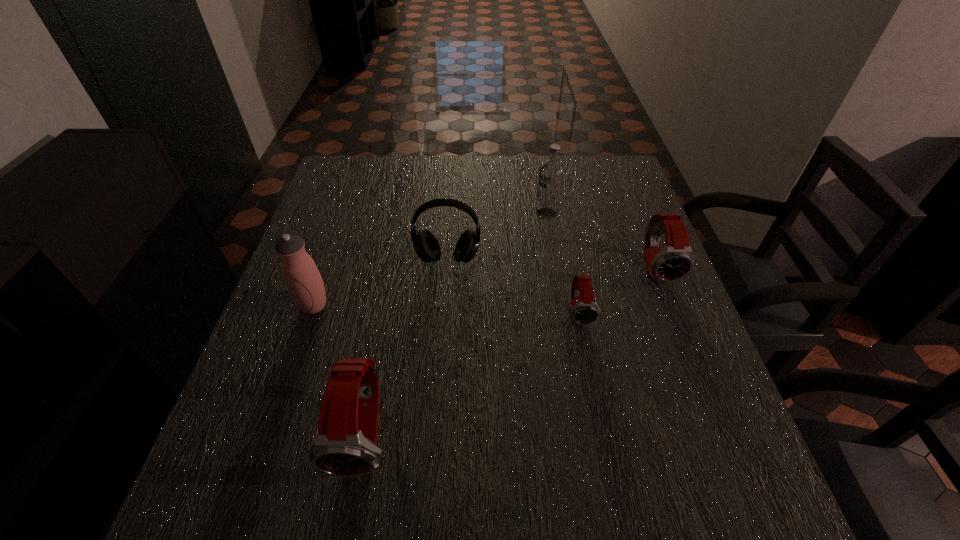
The image size is (960, 540). I want to click on unoccupied position between the shortest object and the thermos bottle, so click(446, 309).

Where is `vacant point located between the headset and the nearest watch`? The width and height of the screenshot is (960, 540). vacant point located between the headset and the nearest watch is located at coordinates [407, 347].

Locate an element on the screen. The height and width of the screenshot is (540, 960). free space between the nearest object and the vodka is located at coordinates (457, 325).

You are a GUI agent. You are given a task and a screenshot of the screen. Output one action in this format:
    pyautogui.click(x=<x>, y=<y>)
    Task: Click on the object that ranks as the fifth closest to the vodka
    Image resolution: width=960 pixels, height=540 pixels.
    Given the screenshot: What is the action you would take?
    pyautogui.click(x=345, y=445)

Identify the location of object that is the nearest to the headset. This screenshot has height=540, width=960. (551, 173).

Identify which watch is the closest to the vodka. Please provide its 2D coordinates. Your answer should be formatted as a tuple, i.e. [(x, y)], where the tuple contains the x and y coordinates of a point satisfying the conditions above.

[(676, 260)]

Identify the location of watch that can be found as the third closest to the headset. (676, 260).